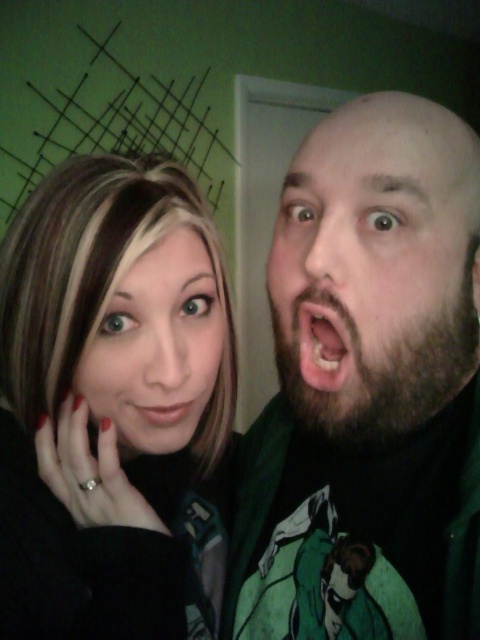
You are a photographer trying to frame a closeup shot of both the matte black hair at left and the matte pink lips at center. Given their sizes, which object should you focus on first to ensure both fit in the frame?

The matte black hair at left is wider than the matte pink lips at center, so you should focus on fitting the matte black hair at left first to ensure both fit in the frame.

You are taking a photo of two people, the matte black hair at left and the bearded face at right. Based on their positions, which one appears taller in the photo?

The matte black hair at left appears taller than the bearded face at right in the photo.

You are a photographer trying to adjust the lighting for a group photo. You notice the bearded face at right and the beige matte skin at center in your frame. Which subject should you focus on if you want to highlight the larger facial features in the photo?

The bearded face at right has a larger size compared to the beige matte skin at center, so you should focus on the bearded face at right to highlight the larger facial features.